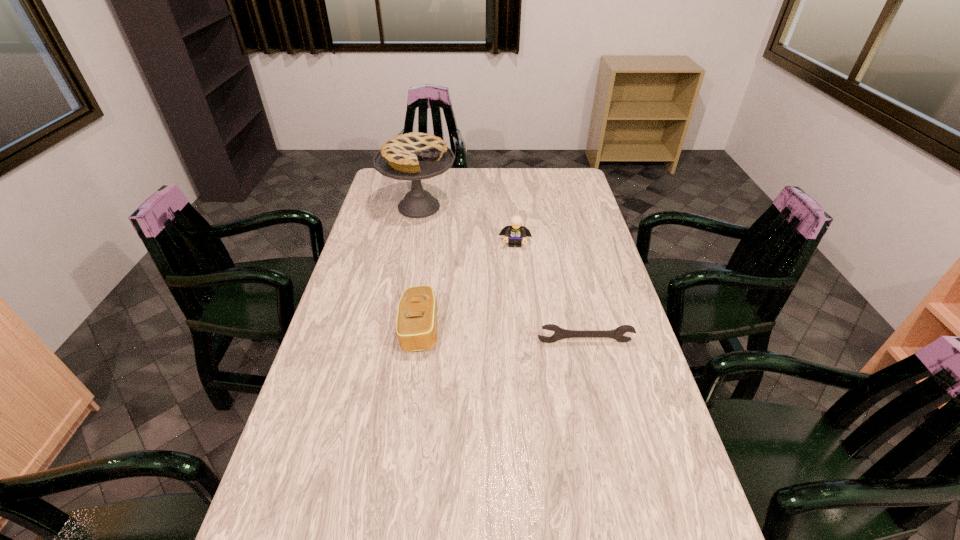
Locate an element on the screen. Image resolution: width=960 pixels, height=540 pixels. clutch bag is located at coordinates (416, 326).

You are a GUI agent. You are given a task and a screenshot of the screen. Output one action in this format:
    pyautogui.click(x=<x>, y=<y>)
    Task: Click on the shortest object
    The image size is (960, 540).
    Given the screenshot: What is the action you would take?
    pyautogui.click(x=560, y=333)

The image size is (960, 540). In order to click on the second tallest object in this screenshot , I will do `click(515, 232)`.

Where is `the third nearest object`? The height and width of the screenshot is (540, 960). the third nearest object is located at coordinates (515, 232).

Identify the location of the farthest object. (412, 156).

This screenshot has height=540, width=960. What are the coordinates of `the tallest object` in the screenshot? It's located at (412, 156).

Locate an element on the screen. Image resolution: width=960 pixels, height=540 pixels. blank space located 0.270m on the zipper side of the clutch bag is located at coordinates (531, 329).

I want to click on free location located 0.220m on the open ends of the wrench, so click(601, 411).

I want to click on vacant area situated on the front-facing side of the Lego, so click(514, 292).

The height and width of the screenshot is (540, 960). In order to click on vacant space located on the front-facing side of the Lego in this screenshot , I will do `click(513, 305)`.